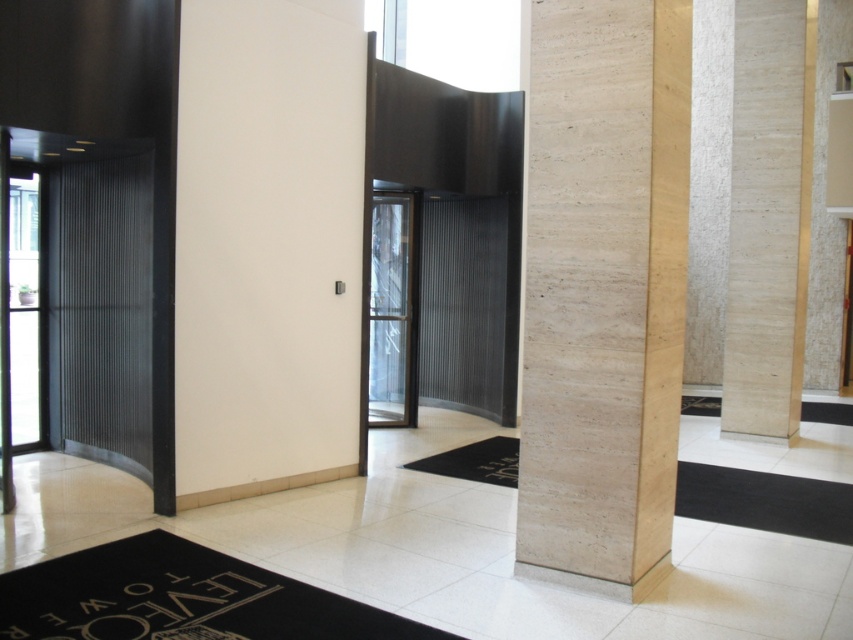
You are a delivery person carrying a large box that is 2 meters wide. You need to pass through the space between the beige marble pillar at right and the metallic ribbed elevator at left. Can your box fit through the gap between them?

The beige marble pillar at right might be wider than metallic ribbed elevator at left, but without knowing the exact width of both objects, it is uncertain whether the 2 meter wide box can fit through the gap between them. Please check the actual dimensions before proceeding.

You are standing in the lobby and need to reach the transparent glass door at center. There is a metallic ribbed elevator at left in your way. Which direction should you move to avoid it?

The metallic ribbed elevator at left is to the left of the transparent glass door at center, so you should move to the right to avoid it.

You are standing at the entrance of the lobby and want to locate the beige marble pillar at right. According to the coordinates, where would you find it?

The beige marble pillar at right is located at point (602, 291).